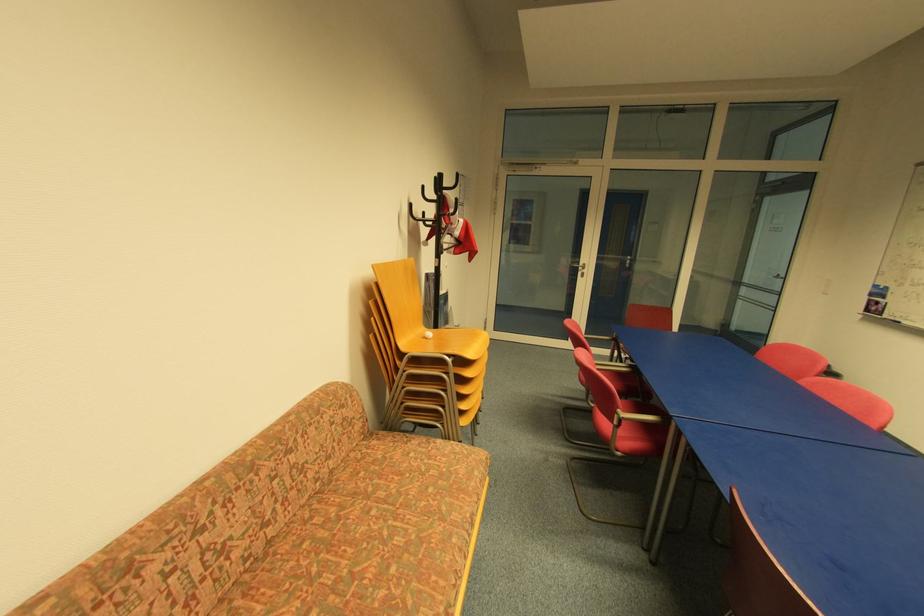
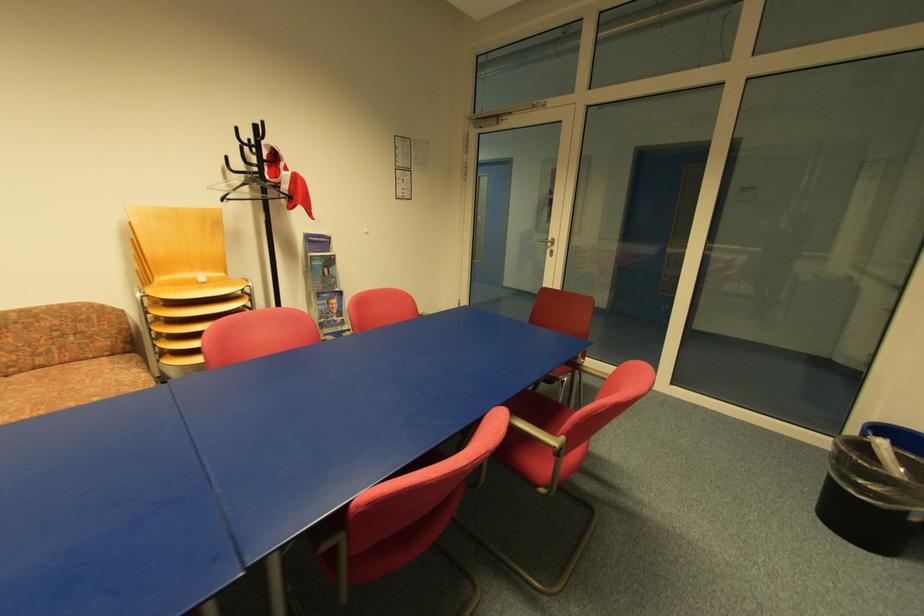
Locate, in the second image, the point that corresponds to the point at 433,339 in the first image.

(207, 285)